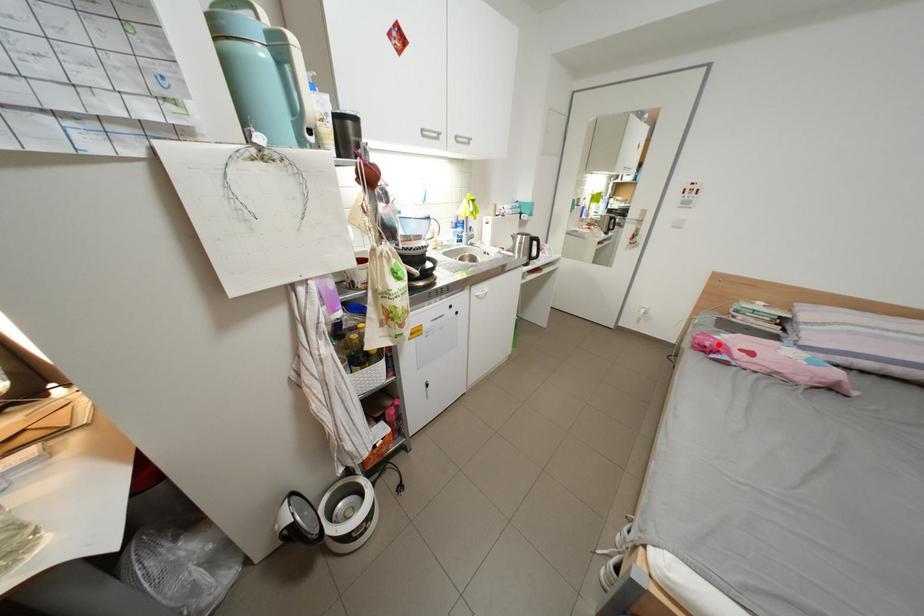
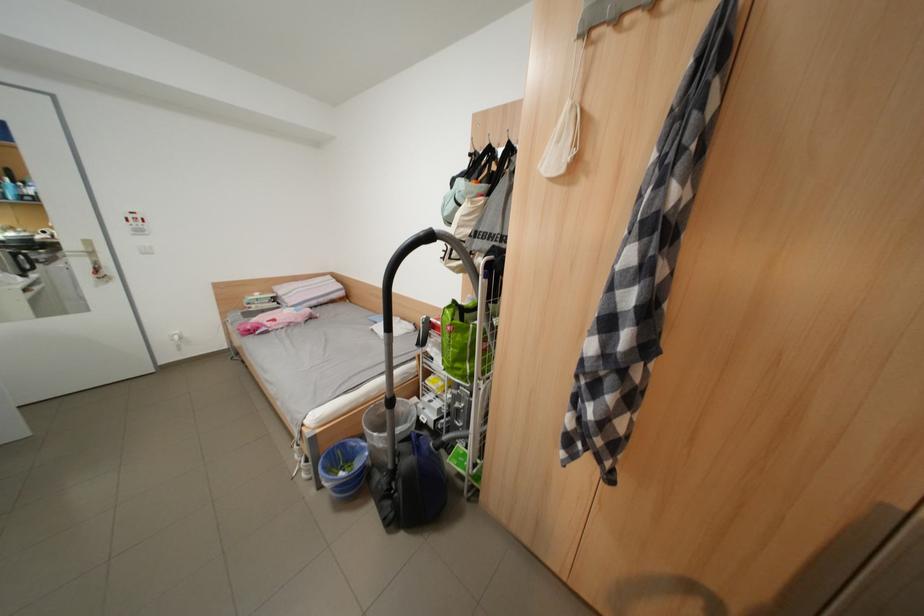
Locate, in the second image, the point that corresponds to the highlighted location in the first image.

(261, 329)